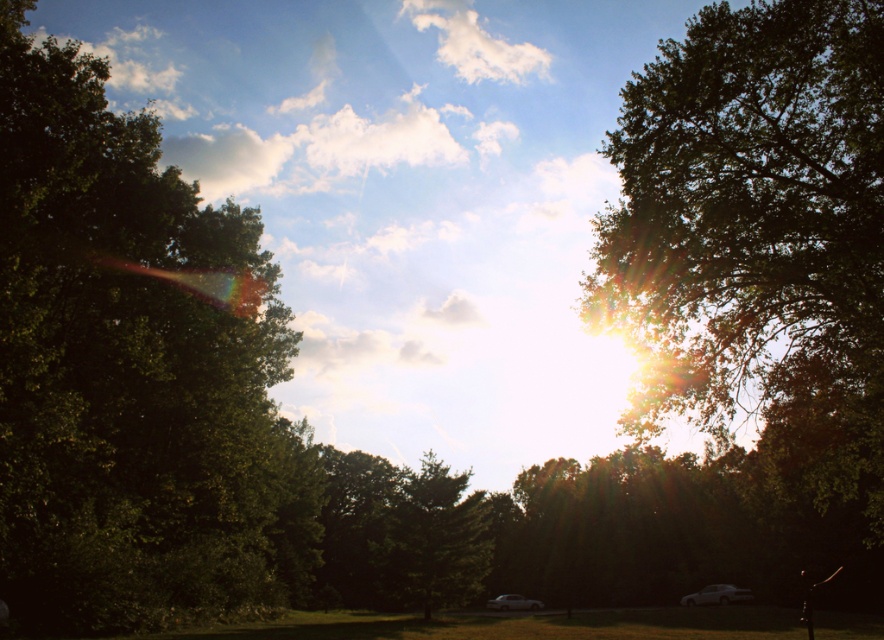
Question: From the image, what is the correct spatial relationship of green leafy tree at upper right in relation to green matte tree at center?

Choices:
 (A) above
 (B) below

Answer: (A)

Question: Is green leafy tree at left below green matte tree at center?

Choices:
 (A) no
 (B) yes

Answer: (A)

Question: Which object appears closest to the camera in this image?

Choices:
 (A) green leafy tree at upper right
 (B) green matte tree at center

Answer: (A)

Question: Does green leafy tree at left have a greater width compared to green matte tree at center?

Choices:
 (A) no
 (B) yes

Answer: (B)

Question: Considering the real-world distances, which object is closest to the green leafy tree at upper right?

Choices:
 (A) green matte tree at center
 (B) green leafy tree at left

Answer: (A)

Question: Which point is farther from the camera taking this photo?

Choices:
 (A) (118, 200)
 (B) (698, 324)

Answer: (A)